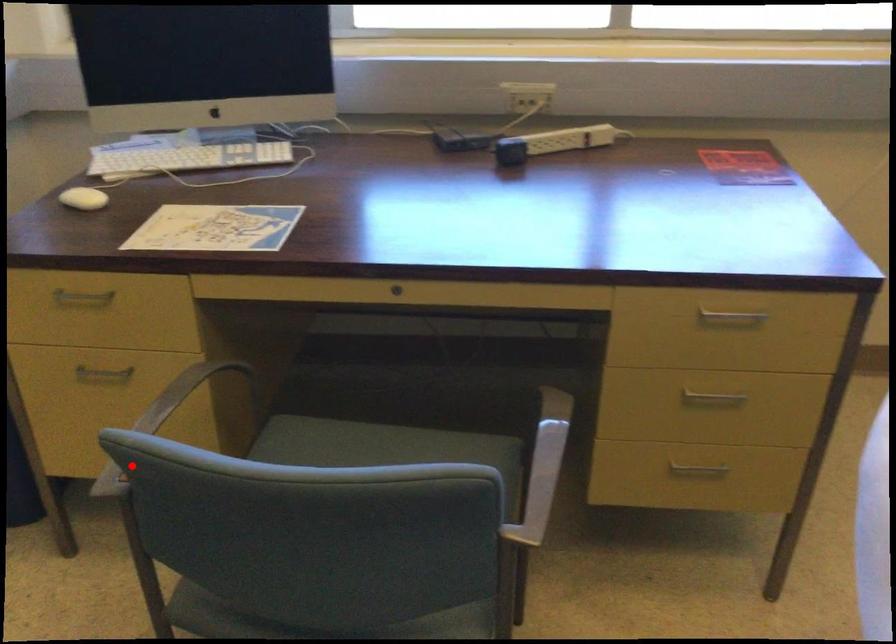
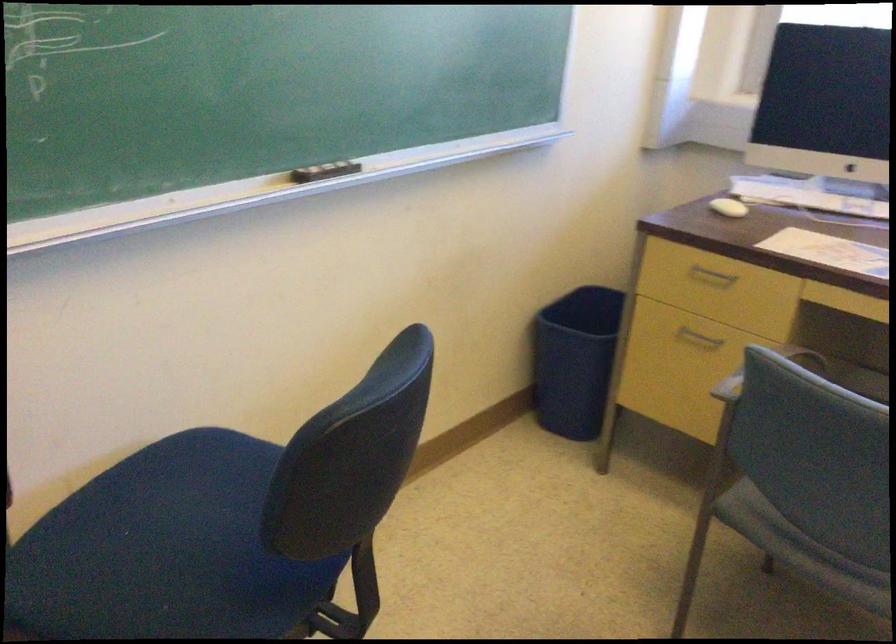
Locate, in the second image, the point that corresponds to the highlighted location in the first image.

(764, 371)